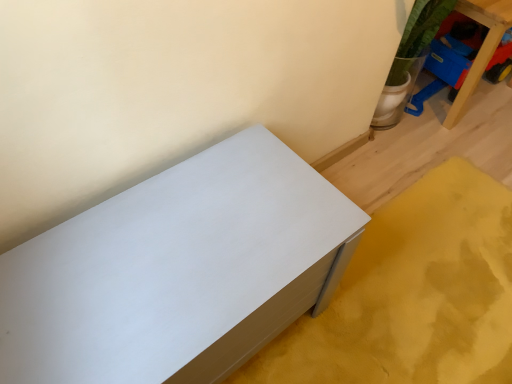
Where is `free space in front of blue plastic toy at upper right, marked as the second furniture in a bottom-to-top arrangement`? The height and width of the screenshot is (384, 512). free space in front of blue plastic toy at upper right, marked as the second furniture in a bottom-to-top arrangement is located at coordinates (479, 146).